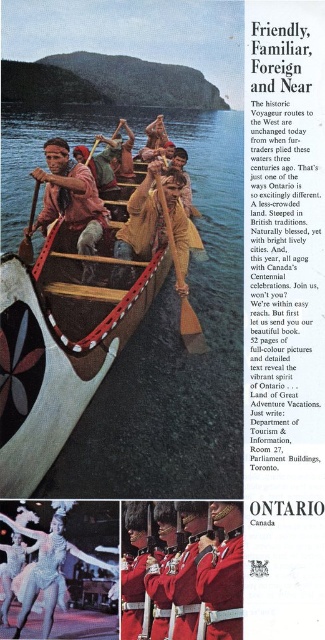
Question: Which point appears farthest from the camera in this image?

Choices:
 (A) (241, 621)
 (B) (150, 524)
 (C) (185, 272)

Answer: (C)

Question: Is rustic wood canoe at center positioned in front of wooden carved paddle at center?

Choices:
 (A) no
 (B) yes

Answer: (A)

Question: Which point appears closest to the camera in this image?

Choices:
 (A) (28, 220)
 (B) (145, 600)

Answer: (B)

Question: Which of the following is the closest to the observer?

Choices:
 (A) (50, 616)
 (B) (206, 602)
 (C) (230, 563)

Answer: (B)

Question: Is shiny red uniform at center smaller than wooden paddle at center?

Choices:
 (A) no
 (B) yes

Answer: (B)

Question: In this image, where is red woolen coat at center located relative to brown wooden paddle at center?

Choices:
 (A) right
 (B) left

Answer: (B)